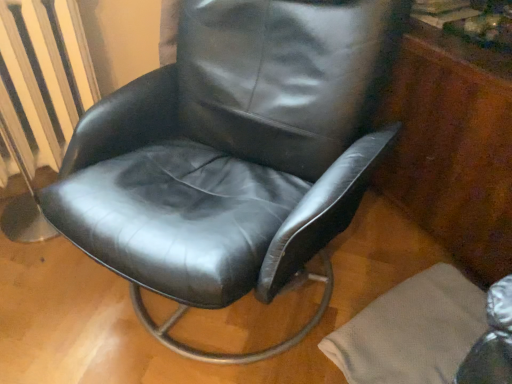
Question: Based on their sizes in the image, would you say black leather chair at center is bigger or smaller than mahogany wood dresser at right?

Choices:
 (A) big
 (B) small

Answer: (A)

Question: From a real-world perspective, relative to mahogany wood dresser at right, is black leather chair at center vertically above or below?

Choices:
 (A) above
 (B) below

Answer: (A)

Question: Estimate the real-world distances between objects in this image. Which object is farther from the metallic silver radiator at left?

Choices:
 (A) mahogany wood dresser at right
 (B) black leather chair at center

Answer: (A)

Question: Which object is positioned closest to the mahogany wood dresser at right?

Choices:
 (A) black leather chair at center
 (B) metallic silver radiator at left

Answer: (A)